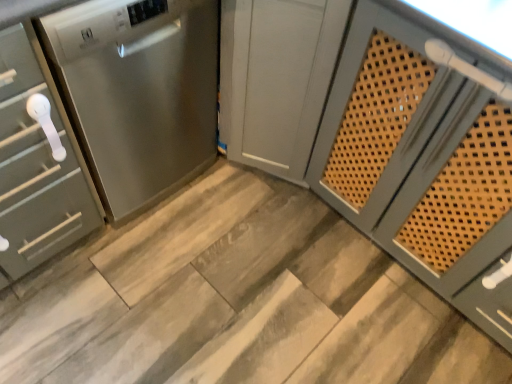
Question: Is satin silver cabinet at left, which ranks as the 2th cabinetry in right-to-left order, at the left side of satin gray cabinet at center, the second cabinetry when ordered from left to right?

Choices:
 (A) yes
 (B) no

Answer: (A)

Question: Is satin gray cabinet at center, the second cabinetry when ordered from left to right, a part of satin silver cabinet at left, which ranks as the 2th cabinetry in right-to-left order?

Choices:
 (A) yes
 (B) no

Answer: (B)

Question: From the image's perspective, is satin silver cabinet at left, which is the 1th cabinetry in left-to-right order, beneath satin gray cabinet at center, the 1th cabinetry positioned from the right?

Choices:
 (A) no
 (B) yes

Answer: (B)

Question: From the image's perspective, is satin silver cabinet at left, which is the 1th cabinetry in left-to-right order, over satin gray cabinet at center, the second cabinetry when ordered from left to right?

Choices:
 (A) no
 (B) yes

Answer: (A)

Question: Does satin silver cabinet at left, which ranks as the 2th cabinetry in right-to-left order, have a larger size compared to satin gray cabinet at center, the 1th cabinetry positioned from the right?

Choices:
 (A) yes
 (B) no

Answer: (B)

Question: Does satin silver cabinet at left, which is the 1th cabinetry in left-to-right order, have a smaller size compared to satin gray cabinet at center, the 1th cabinetry positioned from the right?

Choices:
 (A) no
 (B) yes

Answer: (B)

Question: From a real-world perspective, is stainless steel dishwasher at left located beneath satin silver cabinet at left, which is the 1th cabinetry in left-to-right order?

Choices:
 (A) yes
 (B) no

Answer: (B)

Question: Can you confirm if stainless steel dishwasher at left is bigger than satin silver cabinet at left, which is the 1th cabinetry in left-to-right order?

Choices:
 (A) yes
 (B) no

Answer: (A)

Question: Is stainless steel dishwasher at left shorter than satin silver cabinet at left, which is the 1th cabinetry in left-to-right order?

Choices:
 (A) no
 (B) yes

Answer: (B)

Question: Considering the relative positions of stainless steel dishwasher at left and satin silver cabinet at left, which ranks as the 2th cabinetry in right-to-left order, in the image provided, is stainless steel dishwasher at left behind satin silver cabinet at left, which ranks as the 2th cabinetry in right-to-left order,?

Choices:
 (A) yes
 (B) no

Answer: (A)

Question: Can you confirm if stainless steel dishwasher at left is smaller than satin silver cabinet at left, which is the 1th cabinetry in left-to-right order?

Choices:
 (A) no
 (B) yes

Answer: (A)

Question: Is stainless steel dishwasher at left positioned beyond the bounds of satin silver cabinet at left, which ranks as the 2th cabinetry in right-to-left order?

Choices:
 (A) yes
 (B) no

Answer: (A)

Question: Is satin silver cabinet at left, which is the 1th cabinetry in left-to-right order, facing away from wooden at center?

Choices:
 (A) no
 (B) yes

Answer: (A)